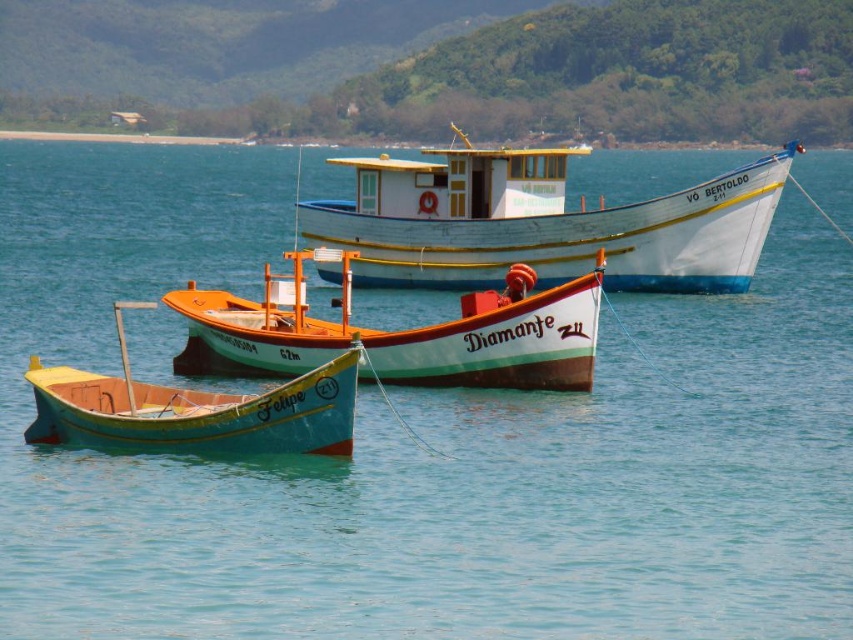
Does white wooden boat at center have a greater height compared to teal matte boat at center?

Yes, white wooden boat at center is taller than teal matte boat at center.

Is point (795, 147) more distant than point (283, 451)?

Yes, point (795, 147) is behind point (283, 451).

Where is `white wooden boat at center`? white wooden boat at center is located at coordinates (543, 224).

Is white wooden boat at center in front of orange wooden boat at center?

No, it is behind orange wooden boat at center.

Can you confirm if white wooden boat at center is positioned to the left of orange wooden boat at center?

Incorrect, white wooden boat at center is not on the left side of orange wooden boat at center.

The width and height of the screenshot is (853, 640). Describe the element at coordinates (543, 224) in the screenshot. I see `white wooden boat at center` at that location.

Image resolution: width=853 pixels, height=640 pixels. Find the location of `white wooden boat at center`. white wooden boat at center is located at coordinates (543, 224).

Is orange wooden boat at center thinner than teal matte boat at center?

No.

The image size is (853, 640). What do you see at coordinates (397, 336) in the screenshot?
I see `orange wooden boat at center` at bounding box center [397, 336].

Locate an element on the screen. This screenshot has width=853, height=640. orange wooden boat at center is located at coordinates (397, 336).